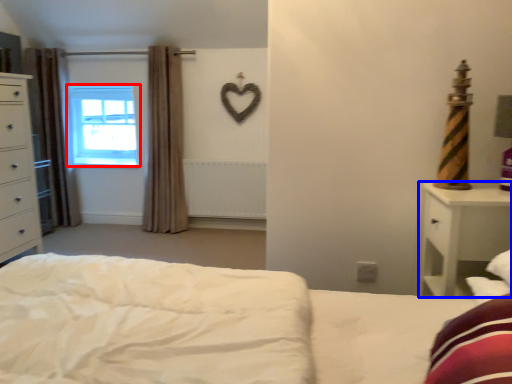
Question: Which point is closer to the camera, window (highlighted by a red box) or nightstand (highlighted by a blue box)?

Choices:
 (A) window
 (B) nightstand

Answer: (B)